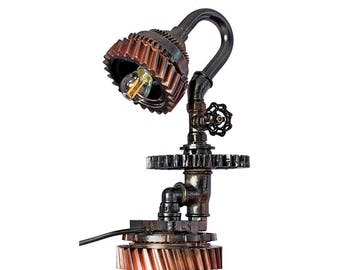
At what (x,y) coordinates should I click in order to perform the action: click on bulb. Please return your answer as a coordinate pair (x, y). This screenshot has height=270, width=340. Looking at the image, I should click on (141, 87).